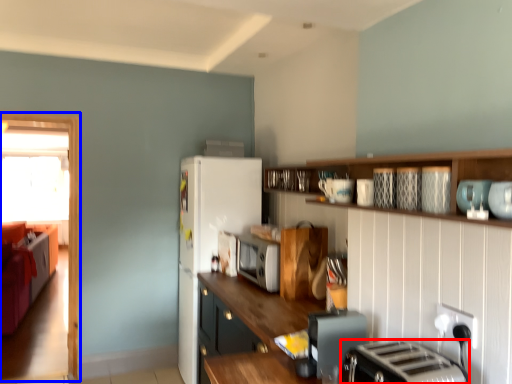
Question: Which object is further to the camera taking this photo, toaster (highlighted by a red box) or glass door (highlighted by a blue box)?

Choices:
 (A) toaster
 (B) glass door

Answer: (B)